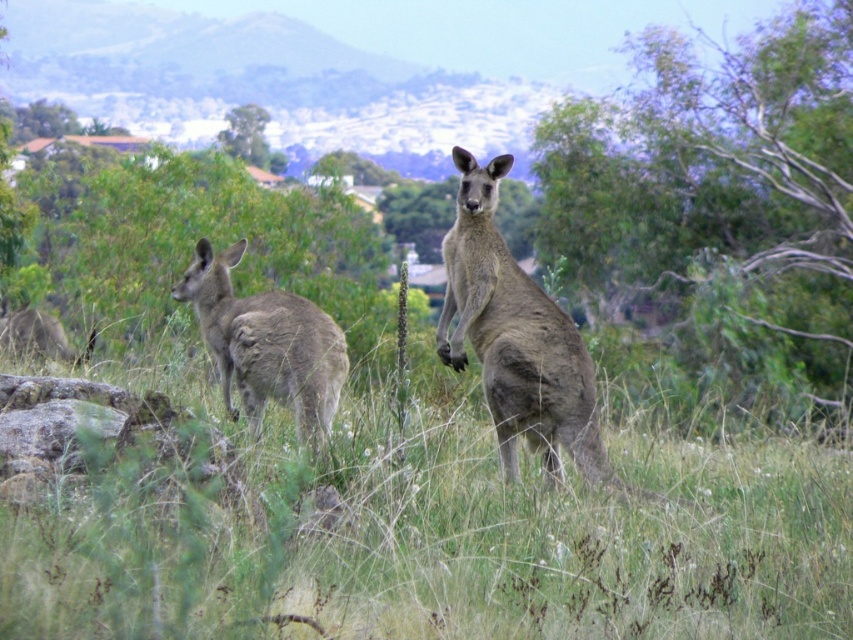
Looking at this image, how much distance is there between gray fur kangaroo at center and green leafy tree at upper center?

A distance of 57.94 feet exists between gray fur kangaroo at center and green leafy tree at upper center.

Does gray fur kangaroo at center appear on the right side of green leafy tree at upper center?

Indeed, gray fur kangaroo at center is positioned on the right side of green leafy tree at upper center.

Image resolution: width=853 pixels, height=640 pixels. Describe the element at coordinates (265, 344) in the screenshot. I see `gray fur kangaroo at center` at that location.

What are the coordinates of `gray fur kangaroo at center` in the screenshot? It's located at (265, 344).

Between grayish-brown fur kangaroo at center and gray fur kangaroo at center, which one is positioned higher?

grayish-brown fur kangaroo at center is above.

Is grayish-brown fur kangaroo at center further to camera compared to gray fur kangaroo at center?

Yes, it is behind gray fur kangaroo at center.

Image resolution: width=853 pixels, height=640 pixels. I want to click on grayish-brown fur kangaroo at center, so click(x=517, y=339).

Can you confirm if green grass at center is smaller than gray fur kangaroo at center?

Incorrect, green grass at center is not smaller in size than gray fur kangaroo at center.

Identify the location of green grass at center. The height and width of the screenshot is (640, 853). (448, 545).

At what (x,y) coordinates should I click in order to perform the action: click on green grass at center. Please return your answer as a coordinate pair (x, y). The image size is (853, 640). Looking at the image, I should click on (448, 545).